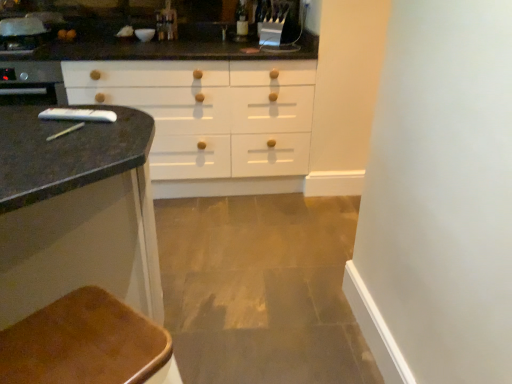
Question: Is metallic faucet at upper center oriented away from brown leather chair at lower left?

Choices:
 (A) no
 (B) yes

Answer: (A)

Question: Is metallic faucet at upper center oriented towards brown leather chair at lower left?

Choices:
 (A) no
 (B) yes

Answer: (A)

Question: Is metallic faucet at upper center far away from brown leather chair at lower left?

Choices:
 (A) yes
 (B) no

Answer: (A)

Question: Considering the relative sizes of metallic faucet at upper center and brown leather chair at lower left in the image provided, is metallic faucet at upper center wider than brown leather chair at lower left?

Choices:
 (A) no
 (B) yes

Answer: (A)

Question: Can you confirm if metallic faucet at upper center is positioned to the right of brown leather chair at lower left?

Choices:
 (A) no
 (B) yes

Answer: (A)

Question: From the image's perspective, is metallic faucet at upper center below brown leather chair at lower left?

Choices:
 (A) yes
 (B) no

Answer: (B)

Question: Are brown leather chair at lower left and metallic faucet at upper center located far from each other?

Choices:
 (A) no
 (B) yes

Answer: (B)

Question: From a real-world perspective, is brown leather chair at lower left located higher than metallic faucet at upper center?

Choices:
 (A) no
 (B) yes

Answer: (A)

Question: Is brown leather chair at lower left positioned in front of metallic faucet at upper center?

Choices:
 (A) yes
 (B) no

Answer: (A)

Question: Is brown leather chair at lower left shorter than metallic faucet at upper center?

Choices:
 (A) yes
 (B) no

Answer: (B)

Question: Does brown leather chair at lower left have a greater width compared to metallic faucet at upper center?

Choices:
 (A) no
 (B) yes

Answer: (B)

Question: Is brown leather chair at lower left outside of metallic faucet at upper center?

Choices:
 (A) no
 (B) yes

Answer: (B)

Question: Is point (175, 31) closer or farther from the camera than point (10, 377)?

Choices:
 (A) farther
 (B) closer

Answer: (A)